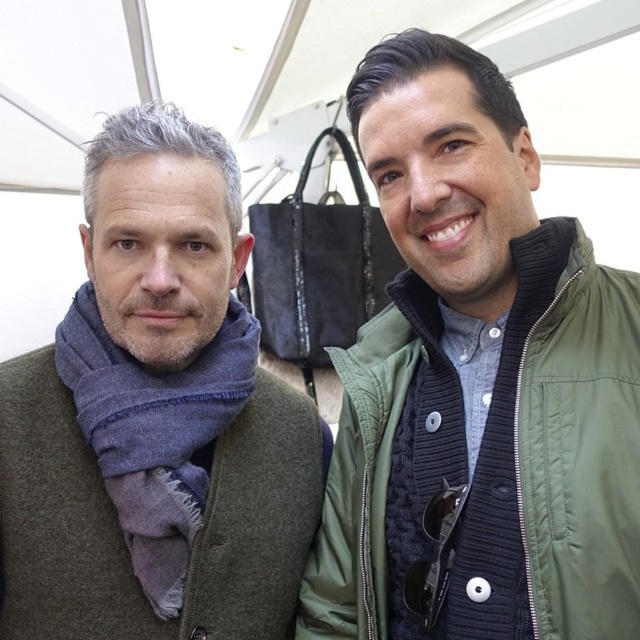
You are a photographer standing at the camera position. You want to place a small decoration exactly 1 meter away from the camera. Is the point at point (x=508, y=253) within the required distance?

The point at point (x=508, y=253) is 87.23 centimeters from the camera, which is less than 1 meter. Therefore, it is not within the required distance of exactly 1 meter.

You are a photographer trying to capture a closeup of the blue wool scarf at left and the blue woolen scarf at left. Since both are on the left side, which one is wider?

The blue wool scarf at left is wider than the blue woolen scarf at left.